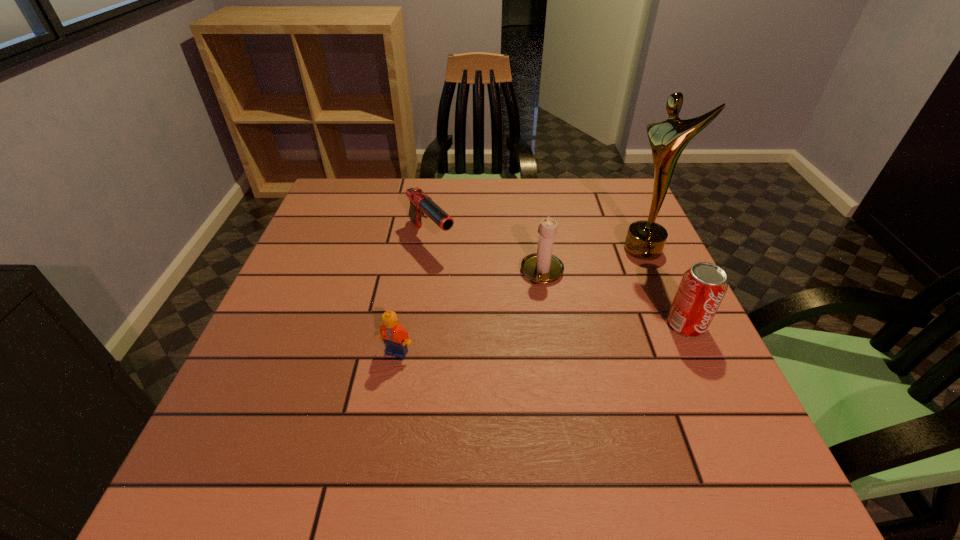
In the image, there is a desktop. In order to click on free space at the near edge in this screenshot , I will do `click(442, 420)`.

At what (x,y) coordinates should I click in order to perform the action: click on vacant space at the left edge of the desktop. Please return your answer as a coordinate pair (x, y). Looking at the image, I should click on (274, 357).

Identify the location of vacant space at the right edge of the desktop. (626, 302).

Locate an element on the screen. free space at the far left corner is located at coordinates (357, 210).

Identify the location of free space at the near left corner. Image resolution: width=960 pixels, height=540 pixels. (302, 406).

In the image, there is a desktop. Where is `vacant space at the far right corner`? This screenshot has height=540, width=960. vacant space at the far right corner is located at coordinates (612, 211).

Locate an element on the screen. Image resolution: width=960 pixels, height=540 pixels. free point between the tallest object and the gun is located at coordinates (537, 244).

Where is `vacant area that lies between the tallest object and the second nearest object`? Image resolution: width=960 pixels, height=540 pixels. vacant area that lies between the tallest object and the second nearest object is located at coordinates point(664,287).

You are a GUI agent. You are given a task and a screenshot of the screen. Output one action in this format:
    pyautogui.click(x=<x>, y=<y>)
    Task: Click on the unoccupied position between the gun and the candle holder
    
    Given the screenshot: What is the action you would take?
    pyautogui.click(x=487, y=255)

Where is `vacant point located between the Lego and the gun`? This screenshot has width=960, height=540. vacant point located between the Lego and the gun is located at coordinates (414, 295).